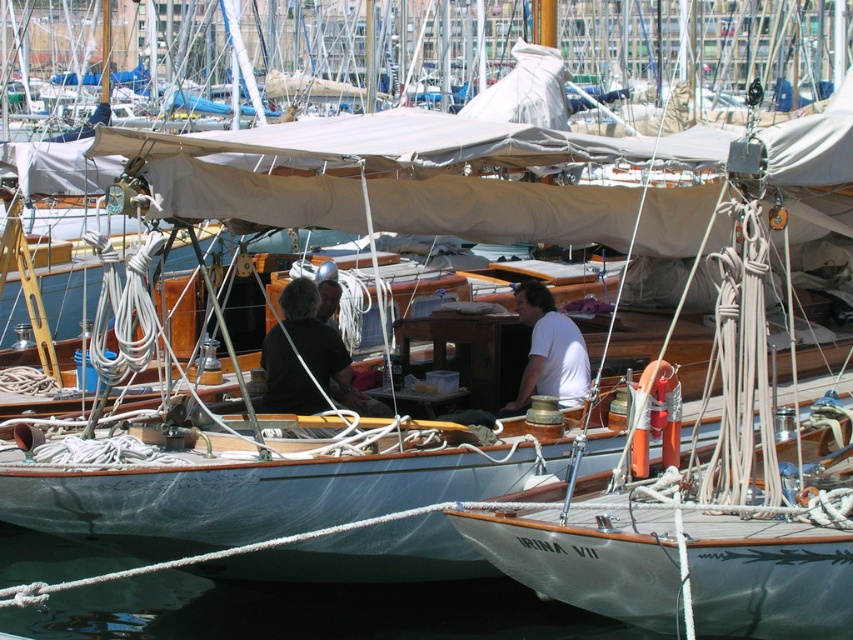
You are standing on the dock looking at the marina scene. You see the transparent water at lower left and the dark brown leather couch at center. Which object is positioned lower in the image?

The transparent water at lower left is located below the dark brown leather couch at center, so it is positioned lower in the image.

You are standing on the dock looking at the marina scene. You see the transparent water at lower left and the white matte shirt at center. Which object is wider from your perspective?

The transparent water at lower left might be wider than the white matte shirt at center according to the description.

You are standing in the marina and see the dark brown leather couch at center and the white matte shirt at center. Which object is positioned lower in the scene?

The dark brown leather couch at center is located below the white matte shirt at center, so it is positioned lower in the scene.